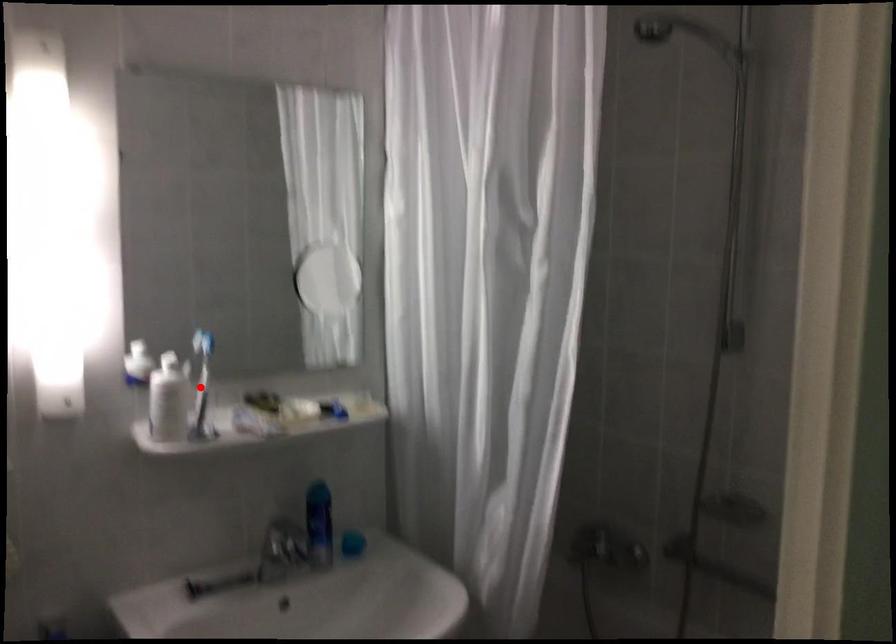
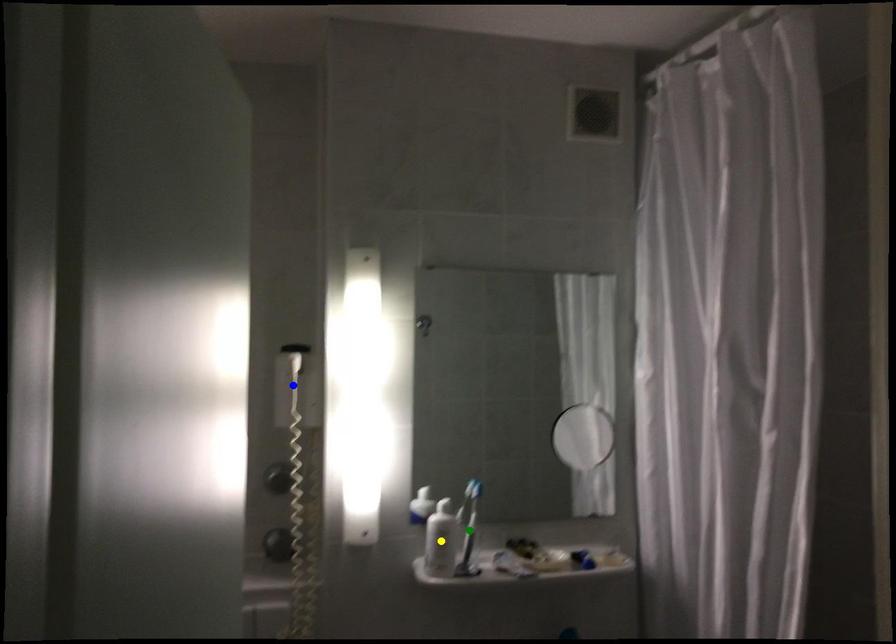
Question: I am providing you with two images of the same scene from different viewpoints. A red point is marked on the first image. You are given multiple points on the second image. Which mark in image 2 goes with the point in image 1?

Choices:
 (A) green point
 (B) yellow point
 (C) blue point

Answer: (A)